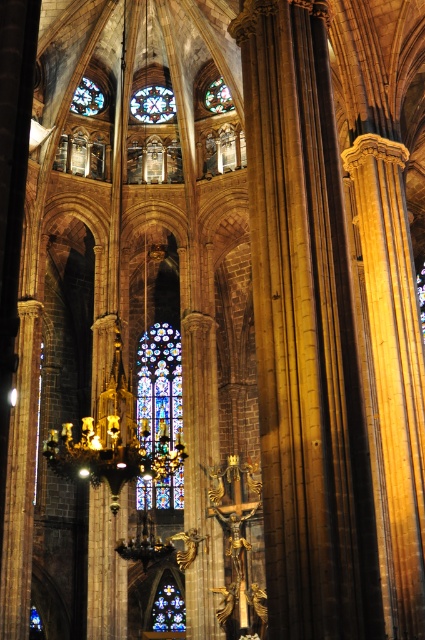
You are standing inside the grand cathedral and notice a point marked at coordinates [159,381]. Based on the cathedral layout described, what significant architectural feature is located at this point?

The point at [159,381] marks the location of the stained glass window at center.

You are standing in the cathedral and want to take a closer look at the golden polished stone column at center and the stained glass window at center. Which object would you need to walk towards first to reach the one that is nearer to you?

The golden polished stone column at center is closer to the viewer than the stained glass window at center, so you should walk towards the golden polished stone column at center first to reach the nearer object.